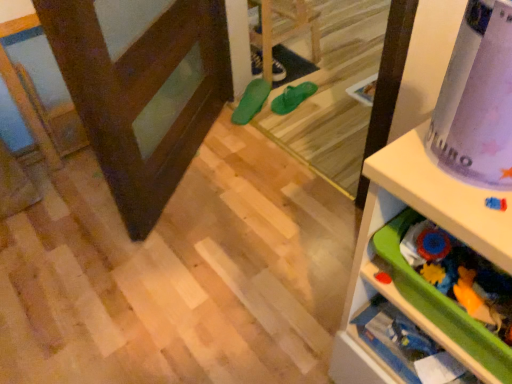
Where is `vacant area that is situated to the right of green rubber flip-flops at center`? vacant area that is situated to the right of green rubber flip-flops at center is located at coordinates (336, 62).